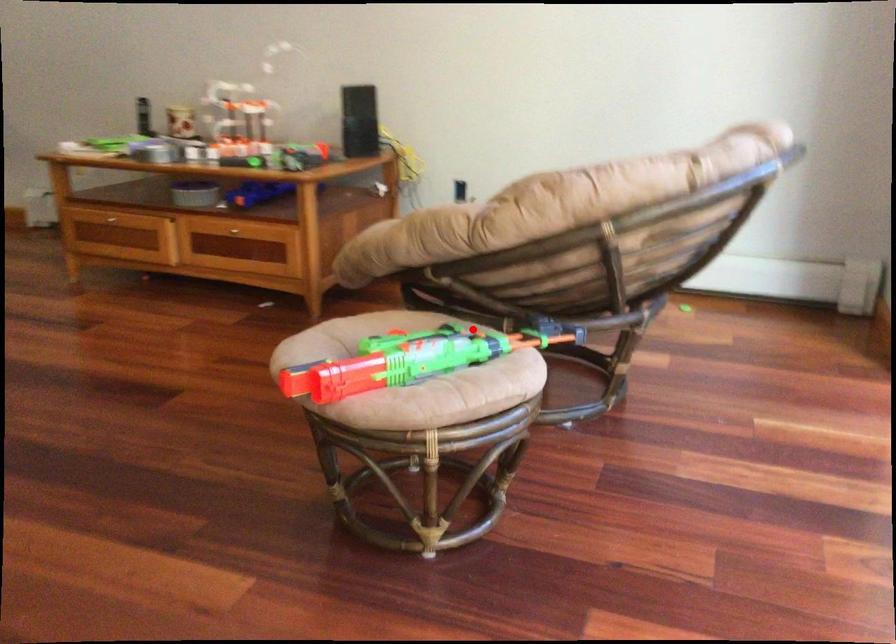
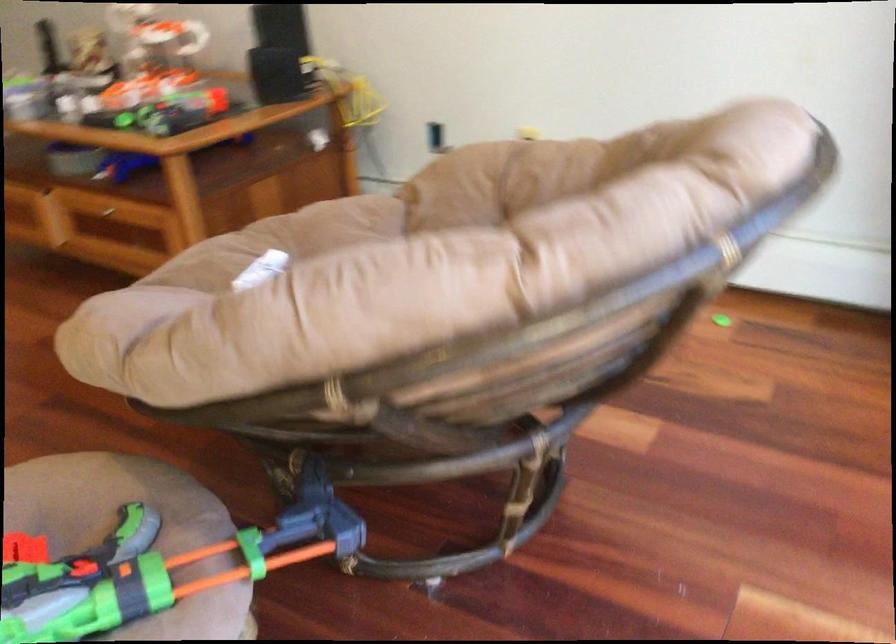
Locate, in the second image, the point that corresponds to the highlighted location in the first image.

(133, 532)